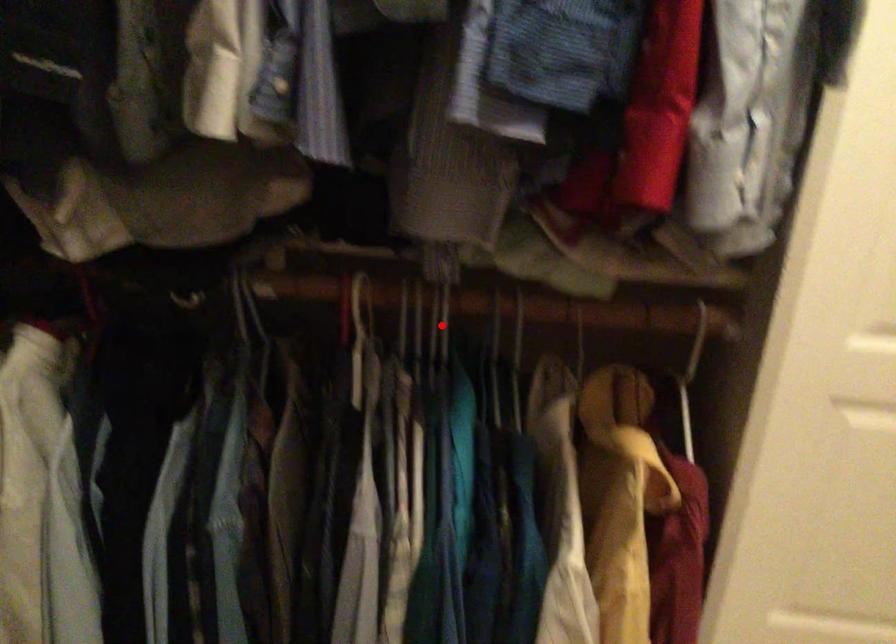
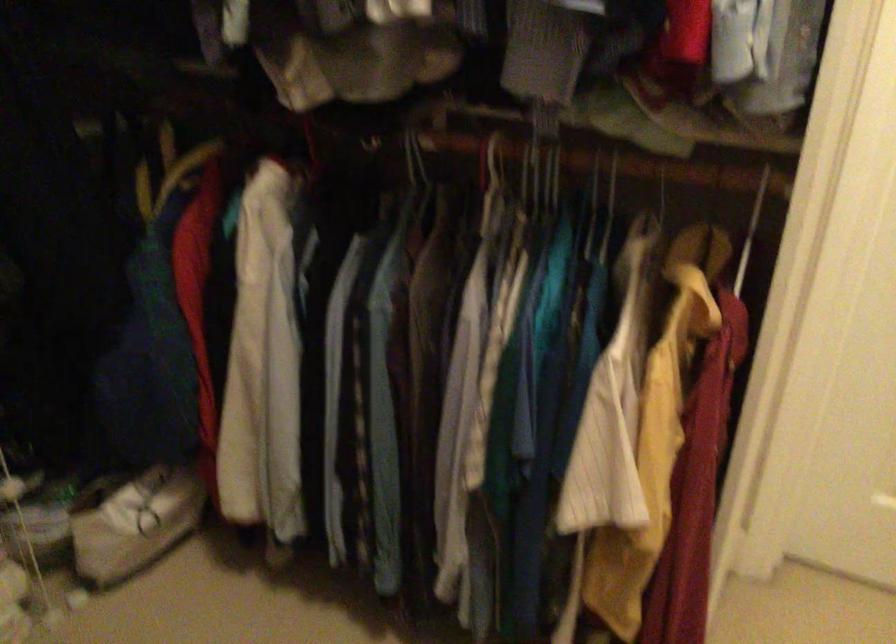
In the second image, find the point that corresponds to the highlighted location in the first image.

(554, 176)